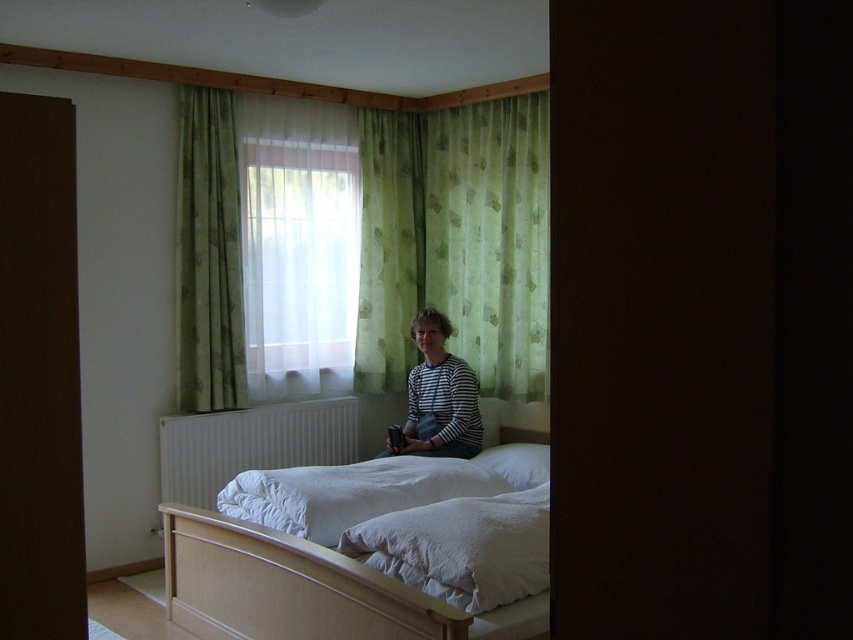
You are a photographer standing in the bedroom and want to ensure that both the green floral fabric curtain at upper center and the white metallic radiator at lower center are in focus in your shot. Given that your camera can only focus on objects within a 20 inch range, will both objects be in focus?

The green floral fabric curtain at upper center is 23.74 inches away from the white metallic radiator at lower center. Since the distance between them exceeds the camera focus range of 20 inches, both objects cannot be in focus simultaneously.

You are a photographer setting up a shot in the bedroom. You need to position your camera so that the translucent fabric window at center and the green floral fabric curtain at upper center are both in frame. How far apart are these two fabrics in inches?

The translucent fabric window at center is 15.33 inches from green floral fabric curtain at upper center, so they are 15.33 inches apart.